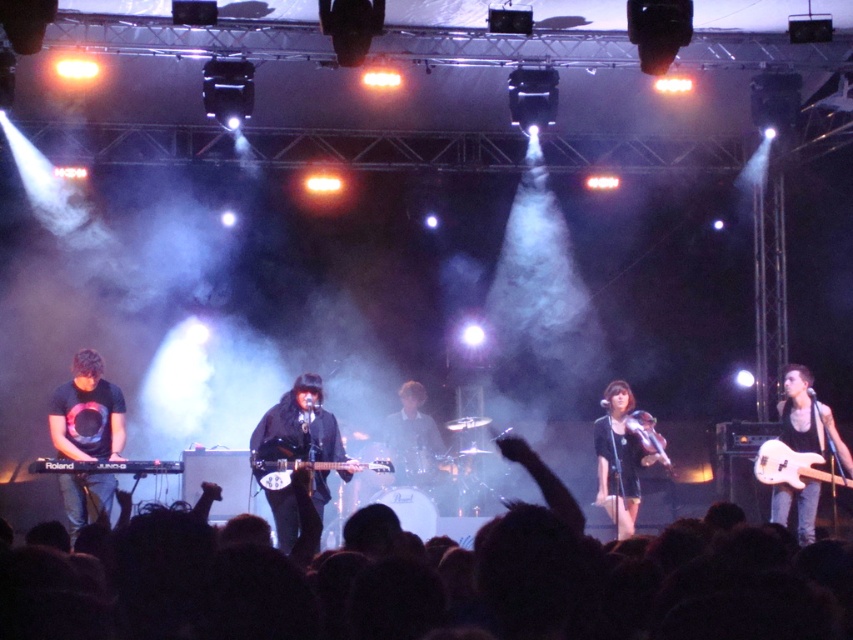
Which is more to the right, black matte keyboardist at left or white glossy electric guitar at right?

white glossy electric guitar at right

Identify the location of black matte keyboardist at left. (86, 413).

Who is positioned more to the right, black matte guitar at center or black matte guitar at right?

From the viewer's perspective, black matte guitar at right appears more on the right side.

Is black matte guitar at center closer to the viewer compared to black matte guitar at right?

Yes, it is.

Which is behind, point (337, 449) or point (786, 404)?

The point (786, 404) is behind.

This screenshot has height=640, width=853. What are the coordinates of `black matte guitar at center` in the screenshot? It's located at (302, 426).

Is black matte guitar at right to the right of white glossy electric guitar at right from the viewer's perspective?

Yes, black matte guitar at right is to the right of white glossy electric guitar at right.

Where is `black matte guitar at right`? The image size is (853, 640). black matte guitar at right is located at coordinates (807, 419).

At what (x,y) coordinates should I click in order to perform the action: click on black matte guitar at right. Please return your answer as a coordinate pair (x, y). The image size is (853, 640). Looking at the image, I should click on (807, 419).

At what (x,y) coordinates should I click in order to perform the action: click on black matte guitar at right. Please return your answer as a coordinate pair (x, y). The width and height of the screenshot is (853, 640). Looking at the image, I should click on (807, 419).